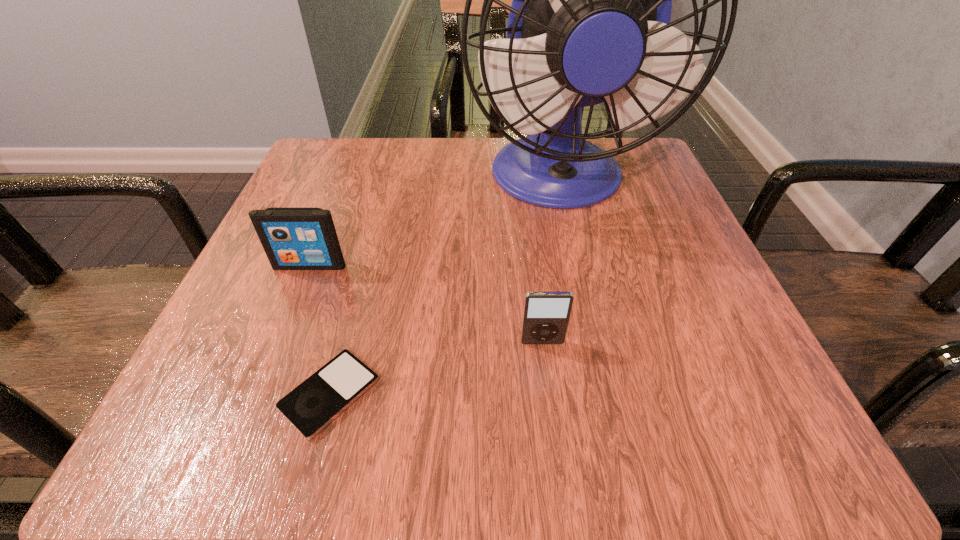
In the image, there is a desktop. In order to click on vacant space at the near left corner in this screenshot , I will do `click(188, 425)`.

In the image, there is a desktop. Identify the location of vacant area at the far right corner. This screenshot has height=540, width=960. (636, 156).

This screenshot has height=540, width=960. I want to click on free spot between the fan and the second farthest iPod, so click(x=550, y=261).

What are the coordinates of `free spot between the tallest object and the shortest iPod` in the screenshot? It's located at (444, 287).

Identify the location of unoccupied area between the nearest iPod and the farthest iPod. (320, 330).

Where is `vacant area between the third nearest object and the nearest iPod`? The width and height of the screenshot is (960, 540). vacant area between the third nearest object and the nearest iPod is located at coordinates (320, 330).

In order to click on vacant space that's between the second farthest object and the second farthest iPod in this screenshot , I will do `click(426, 304)`.

The image size is (960, 540). Find the location of `free space between the nearest object and the fan`. free space between the nearest object and the fan is located at coordinates (444, 287).

Identify the location of free point between the nearest iPod and the rightmost iPod. (436, 368).

This screenshot has width=960, height=540. I want to click on free space between the fan and the shortest object, so click(444, 287).